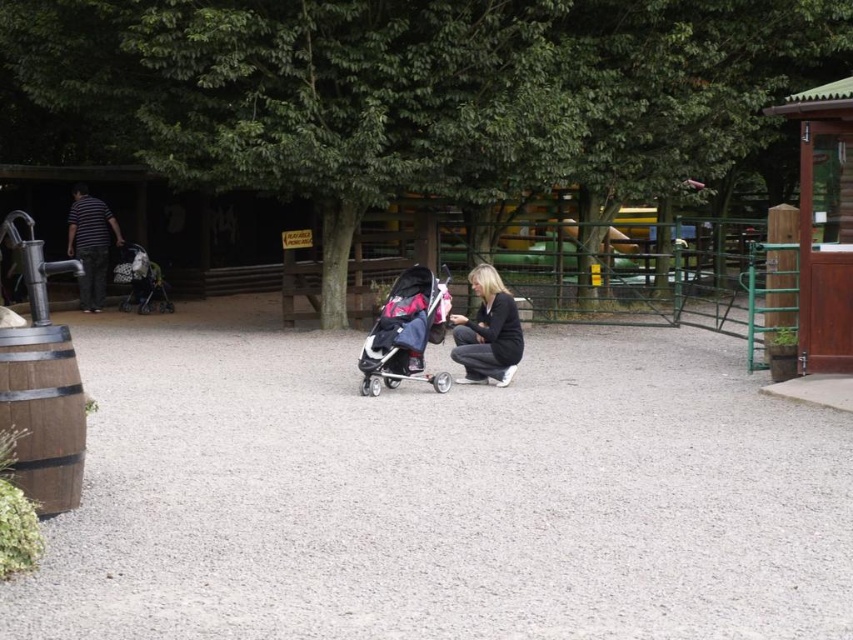
Is point (585, 339) in front of point (381, 305)?

Yes, point (585, 339) is closer to viewer.

Does point (155, 464) lie in front of point (416, 280)?

Yes, it is.

This screenshot has width=853, height=640. Find the location of `gray gravel at center`. gray gravel at center is located at coordinates (442, 497).

Does pink fabric stroller at center have a lesser height compared to dark gray fabric jacket at center?

Incorrect, pink fabric stroller at center's height does not fall short of dark gray fabric jacket at center's.

Which is more to the left, pink fabric stroller at center or dark gray fabric jacket at center?

Positioned to the left is pink fabric stroller at center.

Between point (405, 340) and point (488, 365), which one is positioned in front?

Point (405, 340)

At what (x,y) coordinates should I click in order to perform the action: click on pink fabric stroller at center. Please return your answer as a coordinate pair (x, y). Looking at the image, I should click on (405, 332).

Between point (239, 481) and point (477, 381), which one is positioned behind?

Positioned behind is point (477, 381).

Can you confirm if gray gravel at center is positioned to the right of dark gray fabric jacket at center?

Incorrect, gray gravel at center is not on the right side of dark gray fabric jacket at center.

The height and width of the screenshot is (640, 853). Describe the element at coordinates (442, 497) in the screenshot. I see `gray gravel at center` at that location.

Identify the location of gray gravel at center. [442, 497].